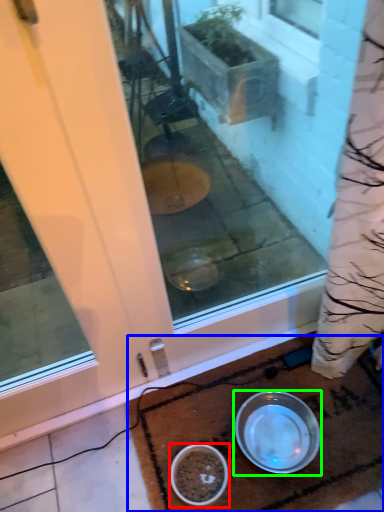
Question: Considering the real-world distances, which object is closest to bowl (highlighted by a red box)? doormat (highlighted by a blue box) or bowl (highlighted by a green box).

Choices:
 (A) doormat
 (B) bowl

Answer: (B)